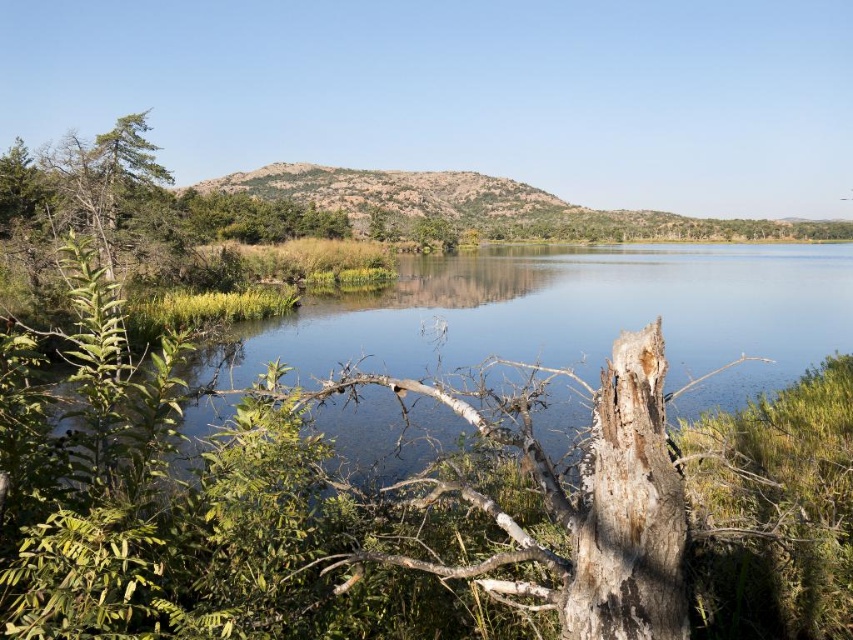
Does clear water at center come behind dark brown rough tree trunk at center?

That is True.

Is point (245, 356) positioned before point (610, 499)?

No, (245, 356) is further to viewer.

Does point (299, 372) come in front of point (596, 532)?

That is False.

Locate an element on the screen. The image size is (853, 640). clear water at center is located at coordinates (572, 317).